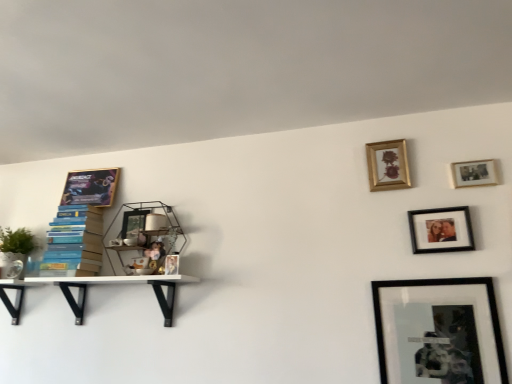
I want to click on gold-framed poster at upper left, placed as the 6th picture frame when sorted from front to back, so click(x=90, y=187).

This screenshot has height=384, width=512. Describe the element at coordinates (90, 187) in the screenshot. I see `gold-framed poster at upper left, the 1th picture frame positioned from the back` at that location.

Locate an element on the screen. black matte picture frame at lower right, which ranks as the fourth picture frame in left-to-right order is located at coordinates (438, 331).

Where is `matte black picture frame at upper right, which is counted as the 2th picture frame, starting from the front`? This screenshot has width=512, height=384. matte black picture frame at upper right, which is counted as the 2th picture frame, starting from the front is located at coordinates (441, 230).

How many degrees apart are the facing directions of black matte picture frame at lower right, which ranks as the 6th picture frame in back-to-front order, and gold-framed poster at upper left, the 1th picture frame positioned from the back?

0.238 degrees separate the facing orientations of black matte picture frame at lower right, which ranks as the 6th picture frame in back-to-front order, and gold-framed poster at upper left, the 1th picture frame positioned from the back.

Looking at their sizes, would you say black matte picture frame at lower right, which ranks as the fourth picture frame in left-to-right order, is wider or thinner than gold-framed poster at upper left, placed as the 6th picture frame when sorted from front to back?

Considering their sizes, black matte picture frame at lower right, which ranks as the fourth picture frame in left-to-right order, looks slimmer than gold-framed poster at upper left, placed as the 6th picture frame when sorted from front to back.

Which object is positioned more to the left, black matte picture frame at lower right, positioned as the 3th picture frame in right-to-left order, or gold-framed poster at upper left, arranged as the 6th picture frame when viewed from the right?

From the viewer's perspective, gold-framed poster at upper left, arranged as the 6th picture frame when viewed from the right, appears more on the left side.

Would you say black matte picture frame at lower right, which ranks as the 6th picture frame in back-to-front order, is inside or outside gold-framed poster at upper left, placed as the 6th picture frame when sorted from front to back?

black matte picture frame at lower right, which ranks as the 6th picture frame in back-to-front order, is spatially situated outside gold-framed poster at upper left, placed as the 6th picture frame when sorted from front to back.

In the scene shown: Is metallic wire shelf at upper center, which is the first shelf from right to left, bigger than gold-framed poster at upper left, arranged as the 6th picture frame when viewed from the right?

Yes.

Does point (168, 232) come farther from viewer compared to point (71, 186)?

No, it is in front of (71, 186).

Looking at this image, from the image's perspective, which is above, metallic wire shelf at upper center, the third shelf when ordered from left to right, or gold-framed poster at upper left, arranged as the 6th picture frame when viewed from the right?

gold-framed poster at upper left, arranged as the 6th picture frame when viewed from the right, from the image's perspective.

Considering the relative positions of gold-framed poster at upper left, placed as the 6th picture frame when sorted from front to back, and matte black picture frame at upper right, which is the 2th picture frame from right to left, in the image provided, is gold-framed poster at upper left, placed as the 6th picture frame when sorted from front to back, to the right of matte black picture frame at upper right, which is the 2th picture frame from right to left, from the viewer's perspective?

No, gold-framed poster at upper left, placed as the 6th picture frame when sorted from front to back, is not to the right of matte black picture frame at upper right, which is the 2th picture frame from right to left.

Is matte black picture frame at upper right, which is counted as the 2th picture frame, starting from the front, completely or partially inside gold-framed poster at upper left, the 1th picture frame positioned from the back?

No, matte black picture frame at upper right, which is counted as the 2th picture frame, starting from the front, is located outside of gold-framed poster at upper left, the 1th picture frame positioned from the back.

Is gold-framed poster at upper left, which is counted as the 1th picture frame, starting from the left, oriented away from matte black picture frame at upper right, positioned as the 5th picture frame in back-to-front order?

That's not correct — gold-framed poster at upper left, which is counted as the 1th picture frame, starting from the left, is not looking away from matte black picture frame at upper right, positioned as the 5th picture frame in back-to-front order.

How distant is gold-framed poster at upper left, the 1th picture frame positioned from the back, from matte black picture frame at upper right, which is counted as the 2th picture frame, starting from the front?

gold-framed poster at upper left, the 1th picture frame positioned from the back, and matte black picture frame at upper right, which is counted as the 2th picture frame, starting from the front, are 5.06 feet apart.

From the image's perspective, is gold/glass picture frame at upper right, the 3th picture frame viewed from the left, over metallic wire shelf at upper center, which is the first shelf from right to left?

Yes, from the image's perspective, gold/glass picture frame at upper right, the 3th picture frame viewed from the left, is on top of metallic wire shelf at upper center, which is the first shelf from right to left.

Is gold/glass picture frame at upper right, acting as the third picture frame starting from the back, thinner than metallic wire shelf at upper center, which is the first shelf from right to left?

Yes, gold/glass picture frame at upper right, acting as the third picture frame starting from the back, is thinner than metallic wire shelf at upper center, which is the first shelf from right to left.

Which is nearer, [401,186] or [137,247]?

The point [401,186] is in front.

Does wooden photo frame at upper right, the 3th picture frame in the front-to-back sequence, have a greater width compared to gold-framed poster at upper left, which is counted as the 1th picture frame, starting from the left?

In fact, wooden photo frame at upper right, the 3th picture frame in the front-to-back sequence, might be narrower than gold-framed poster at upper left, which is counted as the 1th picture frame, starting from the left.

Who is shorter, wooden photo frame at upper right, the 3th picture frame in the front-to-back sequence, or gold-framed poster at upper left, placed as the 6th picture frame when sorted from front to back?

wooden photo frame at upper right, the 3th picture frame in the front-to-back sequence, is shorter.

Is wooden photo frame at upper right, which appears as the 4th picture frame when viewed from the back, positioned beyond the bounds of gold-framed poster at upper left, placed as the 6th picture frame when sorted from front to back?

Yes, wooden photo frame at upper right, which appears as the 4th picture frame when viewed from the back, is located beyond the bounds of gold-framed poster at upper left, placed as the 6th picture frame when sorted from front to back.

From the gold-framed poster at upper left, arranged as the 6th picture frame when viewed from the right, count 5th picture frame to the right and point to it. Please provide its 2D coordinates.

[(474, 173)]

Is point (110, 185) positioned before point (62, 272)?

No.

Between gold-framed poster at upper left, placed as the 6th picture frame when sorted from front to back, and blue cardboard boxes at left, which is the 1th shelf in left-to-right order, which one is positioned in front?

blue cardboard boxes at left, which is the 1th shelf in left-to-right order, is in front.

Identify the location of the 2nd shelf directly beneath the gold-framed poster at upper left, which is counted as the 1th picture frame, starting from the left (from a real-world perspective). Image resolution: width=512 pixels, height=384 pixels. (74, 242).

Is gold-framed poster at upper left, which is counted as the 1th picture frame, starting from the left, far away from blue cardboard boxes at left, marked as the 3th shelf in a right-to-left arrangement?

They are positioned close to each other.

Find the location of a particular element. The image size is (512, 384). the 1st picture frame positioned above the white matte shelf at left, the 2th shelf viewed from the left (from the image's perspective) is located at coordinates (133, 221).

Consider the image. Can you confirm if white matte shelf at left, the 2th shelf viewed from the left, is wider than metallic glass picture frame at left, marked as the second picture frame in a left-to-right arrangement?

Correct, the width of white matte shelf at left, the 2th shelf viewed from the left, exceeds that of metallic glass picture frame at left, marked as the second picture frame in a left-to-right arrangement.

Which is less distant, (76, 309) or (131, 216)?

Point (76, 309)

This screenshot has width=512, height=384. Identify the location of picture frame that is the 5th one above the black matte picture frame at lower right, positioned as the 3th picture frame in right-to-left order (from a real-world perspective). (90, 187).

Starting from the metallic wire shelf at upper center, which is the first shelf from right to left, which picture frame is the 2nd one to the left? Please provide its 2D coordinates.

[(90, 187)]

From the image, which object appears to be nearer to matte black picture frame at upper right, which is the 2th picture frame from right to left, metallic glass picture frame at left, marked as the 5th picture frame in a front-to-back arrangement, or metallic wire shelf at upper center, the third shelf when ordered from left to right?

metallic wire shelf at upper center, the third shelf when ordered from left to right, lies closer to matte black picture frame at upper right, which is the 2th picture frame from right to left, than the other object.

Which object lies nearer to the anchor point black matte picture frame at lower right, which ranks as the fourth picture frame in left-to-right order, wooden photo frame at upper right, which appears as the 4th picture frame when viewed from the back, or gold-framed poster at upper left, arranged as the 6th picture frame when viewed from the right?

wooden photo frame at upper right, which appears as the 4th picture frame when viewed from the back, is positioned closer to the anchor black matte picture frame at lower right, which ranks as the fourth picture frame in left-to-right order.

Estimate the real-world distances between objects in this image. Which object is closer to matte black picture frame at upper right, which is the 2th picture frame from right to left, blue cardboard boxes at left, marked as the 3th shelf in a right-to-left arrangement, or metallic glass picture frame at left, which ranks as the fifth picture frame in right-to-left order?

metallic glass picture frame at left, which ranks as the fifth picture frame in right-to-left order, is positioned closer to the anchor matte black picture frame at upper right, which is the 2th picture frame from right to left.

Which object lies nearer to the anchor point wooden photo frame at upper right, acting as the 6th picture frame starting from the left, matte black picture frame at upper right, positioned as the 5th picture frame in back-to-front order, or gold/glass picture frame at upper right, the 3th picture frame viewed from the left?

Among the two, matte black picture frame at upper right, positioned as the 5th picture frame in back-to-front order, is located nearer to wooden photo frame at upper right, acting as the 6th picture frame starting from the left.

Estimate the real-world distances between objects in this image. Which object is closer to white matte shelf at left, the 2th shelf positioned from the right, black matte picture frame at lower right, which ranks as the fourth picture frame in left-to-right order, or blue cardboard boxes at left, marked as the 3th shelf in a right-to-left arrangement?

blue cardboard boxes at left, marked as the 3th shelf in a right-to-left arrangement, is positioned closer to the anchor white matte shelf at left, the 2th shelf positioned from the right.

Which object lies further to the anchor point matte black picture frame at upper right, which is the 2th picture frame from right to left, gold-framed poster at upper left, the 1th picture frame positioned from the back, or metallic wire shelf at upper center, the third shelf when ordered from left to right?

gold-framed poster at upper left, the 1th picture frame positioned from the back, is further to matte black picture frame at upper right, which is the 2th picture frame from right to left.

Looking at the image, which one is located closer to matte black picture frame at upper right, which is counted as the 2th picture frame, starting from the front, metallic wire shelf at upper center, the third shelf when ordered from left to right, or gold/glass picture frame at upper right, the 3th picture frame viewed from the left?

Based on the image, gold/glass picture frame at upper right, the 3th picture frame viewed from the left, appears to be nearer to matte black picture frame at upper right, which is counted as the 2th picture frame, starting from the front.

From the picture: When comparing their distances from gold-framed poster at upper left, arranged as the 6th picture frame when viewed from the right, does blue cardboard boxes at left, marked as the 3th shelf in a right-to-left arrangement, or metallic wire shelf at upper center, the third shelf when ordered from left to right, seem further?

metallic wire shelf at upper center, the third shelf when ordered from left to right, is further to gold-framed poster at upper left, arranged as the 6th picture frame when viewed from the right.

Locate an element on the screen. This screenshot has width=512, height=384. shelf between white matte shelf at left, the 2th shelf viewed from the left, and matte black picture frame at upper right, positioned as the 5th picture frame in back-to-front order, from left to right is located at coordinates (145, 229).

You are a GUI agent. You are given a task and a screenshot of the screen. Output one action in this format:
    pyautogui.click(x=<x>, y=<y>)
    Task: Click on the picture frame located between white matte shelf at left, the 2th shelf viewed from the left, and gold/glass picture frame at upper right, the 4th picture frame in the front-to-back sequence, in the left-right direction
    The image size is (512, 384).
    Given the screenshot: What is the action you would take?
    pyautogui.click(x=133, y=221)

The image size is (512, 384). I want to click on picture frame located between metallic wire shelf at upper center, the third shelf when ordered from left to right, and black matte picture frame at lower right, which ranks as the fourth picture frame in left-to-right order, in the left-right direction, so click(x=388, y=165).

Locate an element on the screen. The width and height of the screenshot is (512, 384). shelf situated between metallic glass picture frame at left, marked as the second picture frame in a left-to-right arrangement, and gold/glass picture frame at upper right, the 3th picture frame viewed from the left, from left to right is located at coordinates (145, 229).